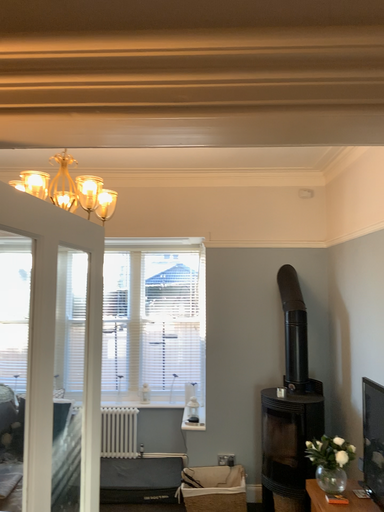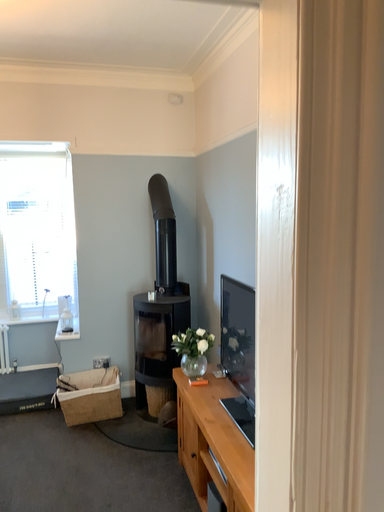
Question: Which way did the camera rotate in the video?

Choices:
 (A) rotated downward
 (B) rotated upward

Answer: (A)